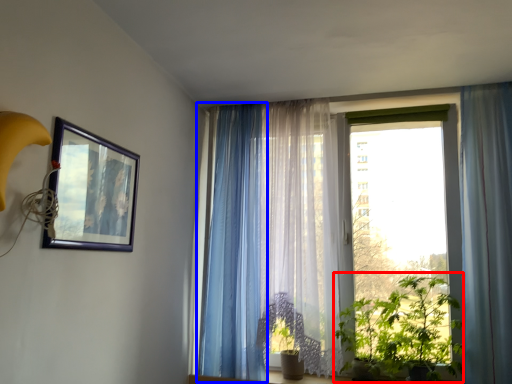
Question: Which object is further to the camera taking this photo, vegetation (highlighted by a red box) or curtain (highlighted by a blue box)?

Choices:
 (A) vegetation
 (B) curtain

Answer: (B)